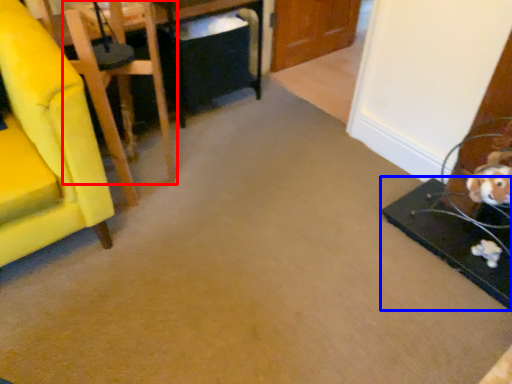
Question: Which of the following is the closest to the observer, chair (highlighted by a red box) or table (highlighted by a blue box)?

Choices:
 (A) chair
 (B) table

Answer: (A)